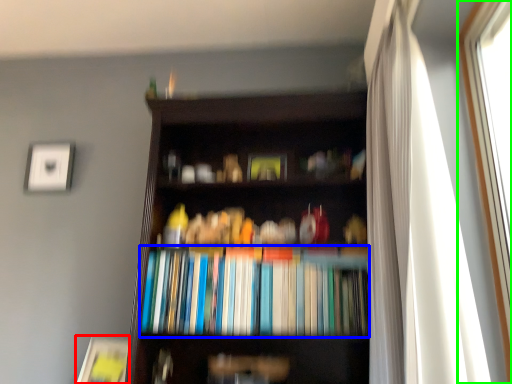
Question: Considering the real-world distances, which object is closest to paperback book (highlighted by a red box)? book (highlighted by a blue box) or window (highlighted by a green box).

Choices:
 (A) book
 (B) window

Answer: (A)